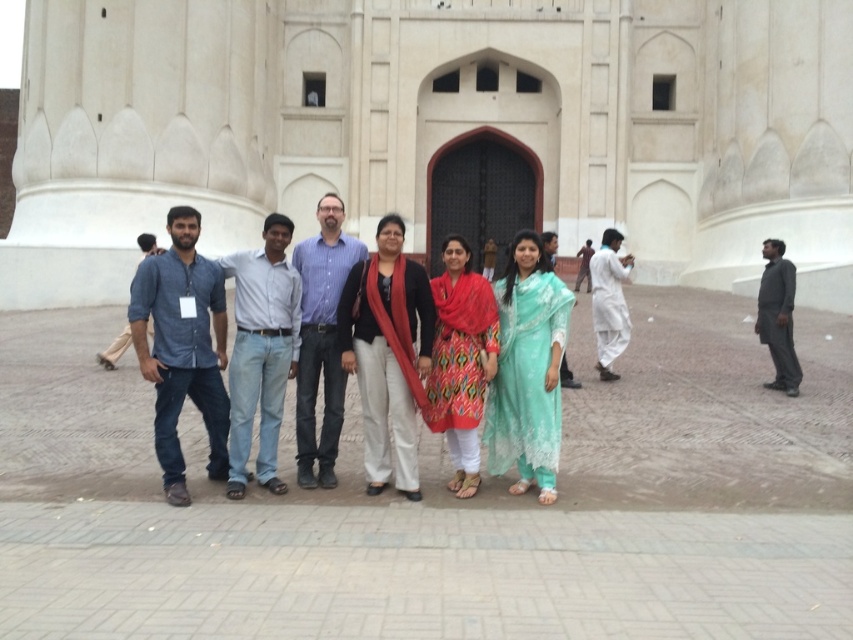
You are a photographer trying to adjust the lighting for a group photo. You notice two key items in the center of the image. Which one is positioned to the left of the other? The items are the matte black jacket at center and the printed cotton dress at center.

The matte black jacket at center is positioned to the left of the printed cotton dress at center.

You are a photographer adjusting the camera settings to capture a clear photo of the matte black jacket at center and the printed cotton dress at center. The camera has a minimum focus distance of 3 feet. Will both subjects be in focus if you position the camera at this distance?

The distance between the matte black jacket at center and the printed cotton dress at center is 37.53 inches, which is less than 3 feet. Therefore, positioning the camera at the minimum focus distance of 3 feet will ensure both subjects are in focus.

Looking at this image, you are a photographer standing 50 feet away from the large ornate building. You want to take a closeup shot of the printed cotton dress at center. Can you reach the dress without moving closer than your current position?

The printed cotton dress at center is 47.44 feet away from the viewer. Since you are currently 50 feet away from the building, you can take the closeup shot without moving closer because the dress is within reach at that distance.